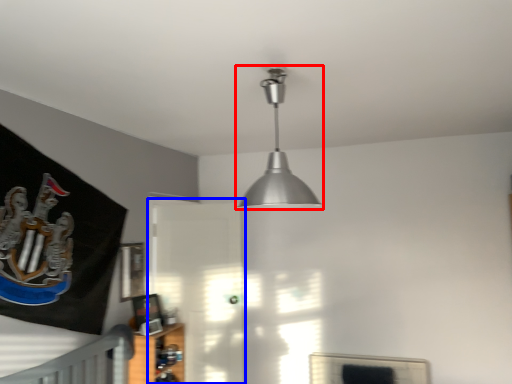
Question: Which of the following is the closest to the observer, lamp (highlighted by a red box) or glass door (highlighted by a blue box)?

Choices:
 (A) lamp
 (B) glass door

Answer: (A)